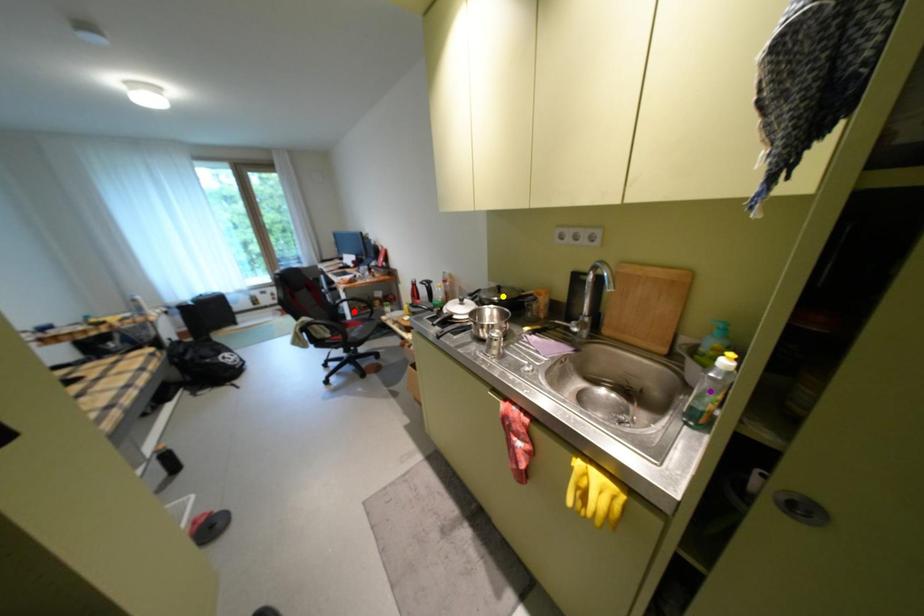
Order these from nearest to farthest:
- yellow point
- purple point
- red point

purple point < yellow point < red point